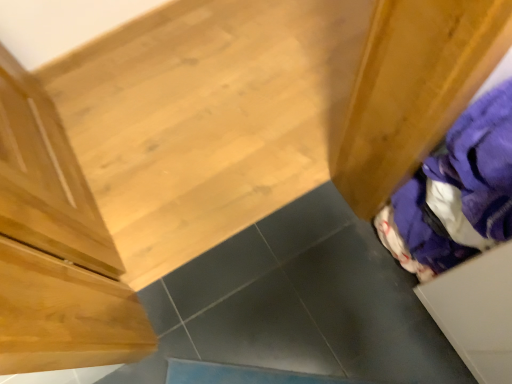
Question: Considering the relative sizes of white matte drawer at lower right and purple fabric at right in the image provided, is white matte drawer at lower right wider than purple fabric at right?

Choices:
 (A) no
 (B) yes

Answer: (B)

Question: From the image's perspective, would you say white matte drawer at lower right is positioned over purple fabric at right?

Choices:
 (A) no
 (B) yes

Answer: (A)

Question: Is white matte drawer at lower right behind purple fabric at right?

Choices:
 (A) yes
 (B) no

Answer: (B)

Question: Is white matte drawer at lower right facing away from purple fabric at right?

Choices:
 (A) yes
 (B) no

Answer: (B)

Question: Is white matte drawer at lower right outside purple fabric at right?

Choices:
 (A) no
 (B) yes

Answer: (B)

Question: From a real-world perspective, is white matte drawer at lower right under purple fabric at right?

Choices:
 (A) yes
 (B) no

Answer: (A)

Question: Considering the relative sizes of purple fabric at right and white matte drawer at lower right in the image provided, is purple fabric at right thinner than white matte drawer at lower right?

Choices:
 (A) no
 (B) yes

Answer: (B)

Question: From a real-world perspective, is purple fabric at right located beneath white matte drawer at lower right?

Choices:
 (A) yes
 (B) no

Answer: (B)

Question: From a real-world perspective, is purple fabric at right positioned over white matte drawer at lower right based on gravity?

Choices:
 (A) yes
 (B) no

Answer: (A)

Question: Considering the relative positions of purple fabric at right and white matte drawer at lower right in the image provided, is purple fabric at right to the left of white matte drawer at lower right from the viewer's perspective?

Choices:
 (A) yes
 (B) no

Answer: (A)

Question: Can you confirm if purple fabric at right is bigger than white matte drawer at lower right?

Choices:
 (A) no
 (B) yes

Answer: (A)

Question: Does purple fabric at right have a smaller size compared to white matte drawer at lower right?

Choices:
 (A) no
 (B) yes

Answer: (B)

Question: Is purple fabric at right situated inside white matte drawer at lower right or outside?

Choices:
 (A) inside
 (B) outside

Answer: (B)